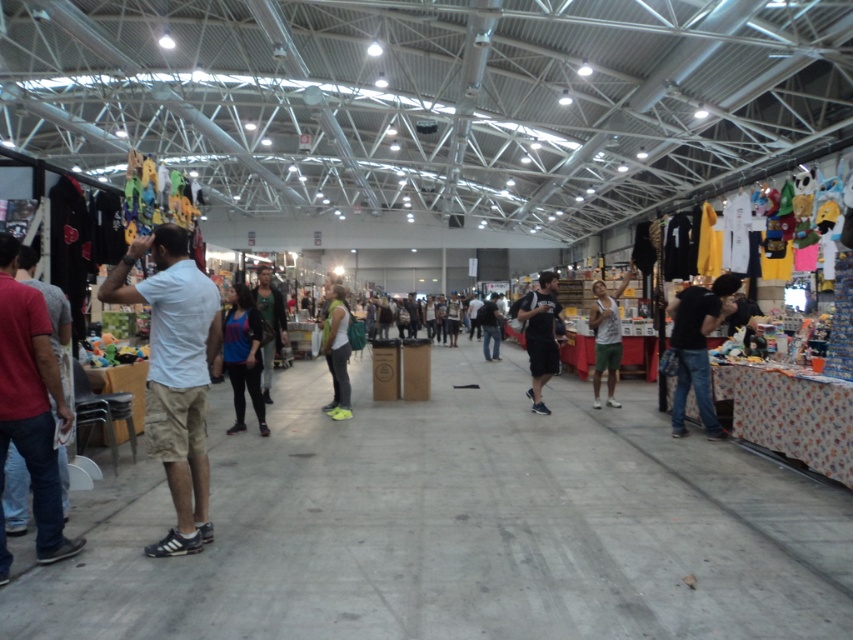
From the picture: Can you confirm if black matte camera at right is wider than gray matte tank top at center-right?

Yes, black matte camera at right is wider than gray matte tank top at center-right.

From the picture: How much distance is there between black matte camera at right and gray matte tank top at center-right?

black matte camera at right and gray matte tank top at center-right are 2.45 meters apart from each other.

Does point (721, 292) lie in front of point (605, 358)?

Yes, it is in front of point (605, 358).

The width and height of the screenshot is (853, 640). In order to click on black matte camera at right in this screenshot , I will do `click(697, 348)`.

Is blue fabric shirt at center further to camera compared to green fabric backpack at center?

No, it is not.

Measure the distance between blue fabric shirt at center and green fabric backpack at center.

The distance of blue fabric shirt at center from green fabric backpack at center is 4.28 feet.

Does point (231, 358) come farther from viewer compared to point (344, 305)?

No.

At what (x,y) coordinates should I click in order to perform the action: click on blue fabric shirt at center. Please return your answer as a coordinate pair (x, y). The image size is (853, 640). Looking at the image, I should click on (242, 355).

Which is more to the left, white cotton shirt at left or leather jacket at center?

From the viewer's perspective, leather jacket at center appears more on the left side.

You are a GUI agent. You are given a task and a screenshot of the screen. Output one action in this format:
    pyautogui.click(x=<x>, y=<y>)
    Task: Click on the white cotton shirt at left
    This screenshot has height=640, width=853.
    Given the screenshot: What is the action you would take?
    pyautogui.click(x=175, y=374)